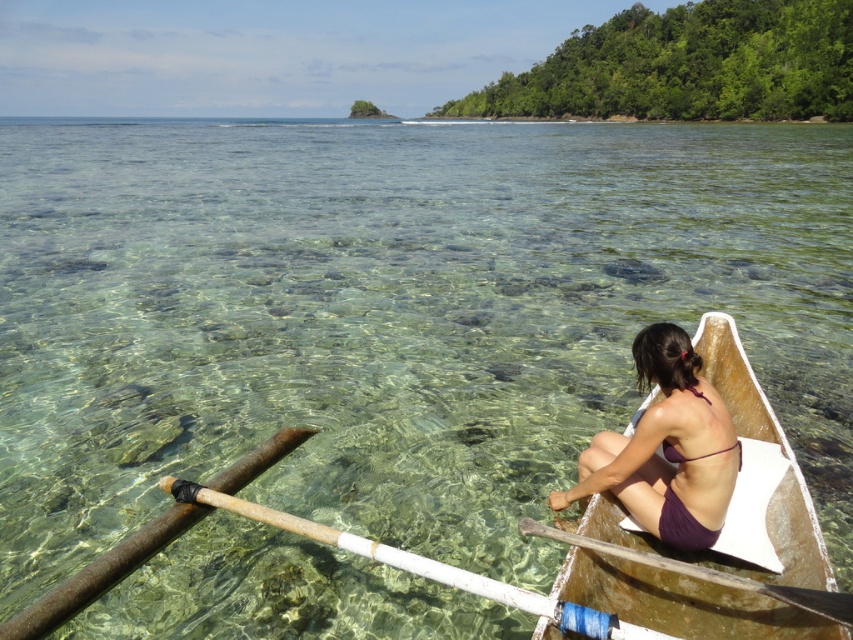
You are a photographer positioned on the shore of the coastal scene. You want to take a photo that includes both the wooden canoe at right and the wooden paddle at lower right. Since you can only focus on one object at a time, which object should you focus on to ensure the other appears in the background?

You should focus on the wooden canoe at right because it is closer to you than the wooden paddle at lower right, which will then appear in the background.

You are in a canoe on a calm lake and need to reach for a paddle. There are two wooden paddles visible in the water. Which one is closer to your left side? The options are the wooden paddle at lower center and the wooden paddle at lower right.

The wooden paddle at lower center is to the left of the wooden paddle at lower right, so the wooden paddle at lower center is closer to your left side.